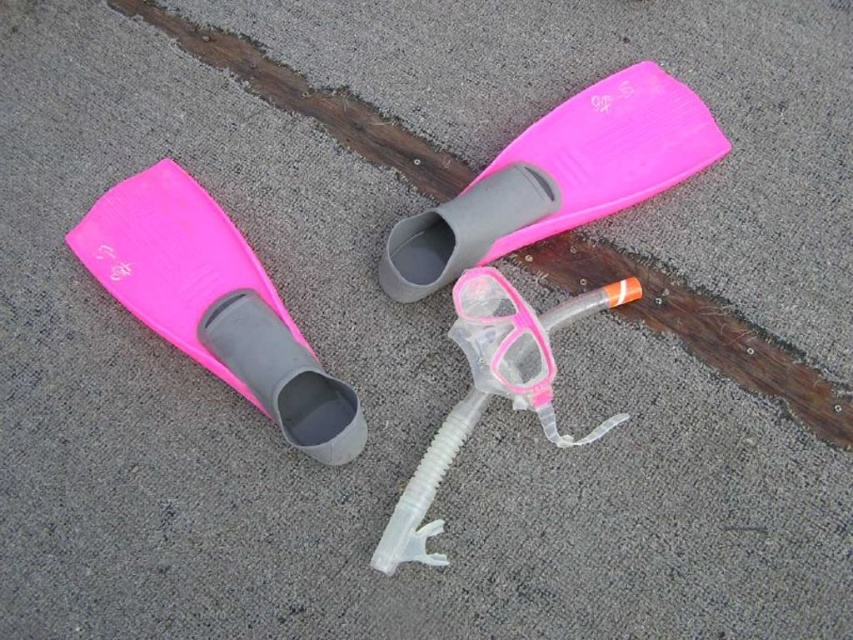
The image size is (853, 640). Describe the element at coordinates (213, 305) in the screenshot. I see `pink matte plastic fins at left` at that location.

Identify the location of pink matte plastic fins at left. The image size is (853, 640). (213, 305).

Find the location of a particular element. pink matte plastic fins at left is located at coordinates (213, 305).

Can you confirm if pink matte plastic fins at left is positioned below pink plastic goggles at center?

Actually, pink matte plastic fins at left is above pink plastic goggles at center.

Which is above, pink matte plastic fins at left or pink plastic goggles at center?

pink matte plastic fins at left is above.

The height and width of the screenshot is (640, 853). Describe the element at coordinates (213, 305) in the screenshot. I see `pink matte plastic fins at left` at that location.

Where is `pink matte plastic fins at left`? The image size is (853, 640). pink matte plastic fins at left is located at coordinates (213, 305).

What do you see at coordinates (558, 177) in the screenshot?
I see `pink matte flippers at upper center` at bounding box center [558, 177].

Measure the distance from pink matte flippers at upper center to pink plastic goggles at center.

pink matte flippers at upper center and pink plastic goggles at center are 7.11 inches apart from each other.

Who is more forward, (654, 176) or (462, 291)?

Point (462, 291) is in front.

Locate an element on the screen. Image resolution: width=853 pixels, height=640 pixels. pink matte flippers at upper center is located at coordinates click(x=558, y=177).